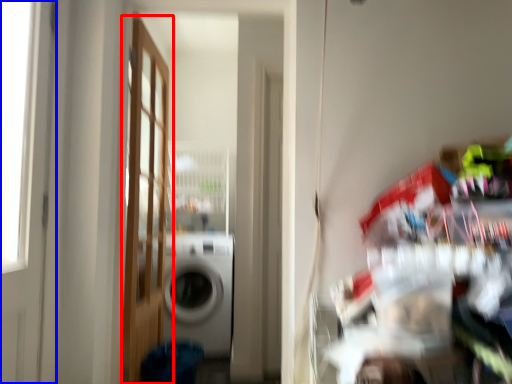
Question: Which of the following is the closest to the observer, door (highlighted by a red box) or door (highlighted by a blue box)?

Choices:
 (A) door
 (B) door

Answer: (B)